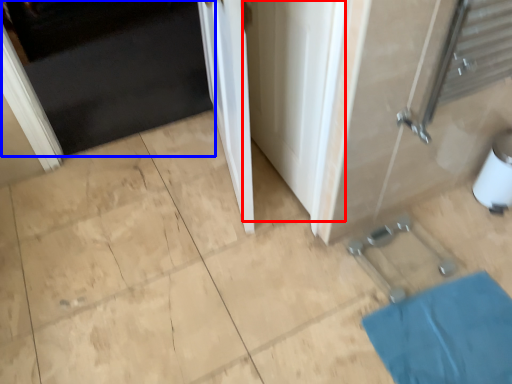
Question: Which of the following is the farthest to the observer, screen door (highlighted by a red box) or door (highlighted by a blue box)?

Choices:
 (A) screen door
 (B) door

Answer: (B)